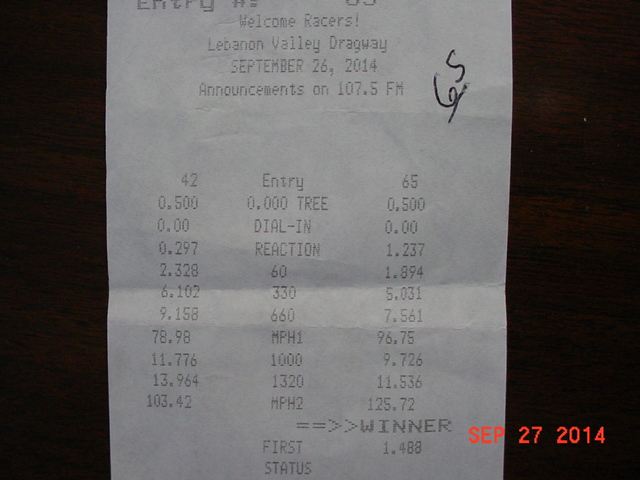
This screenshot has width=640, height=480. Identify the location of empty space on table right of receipt. (563, 247).